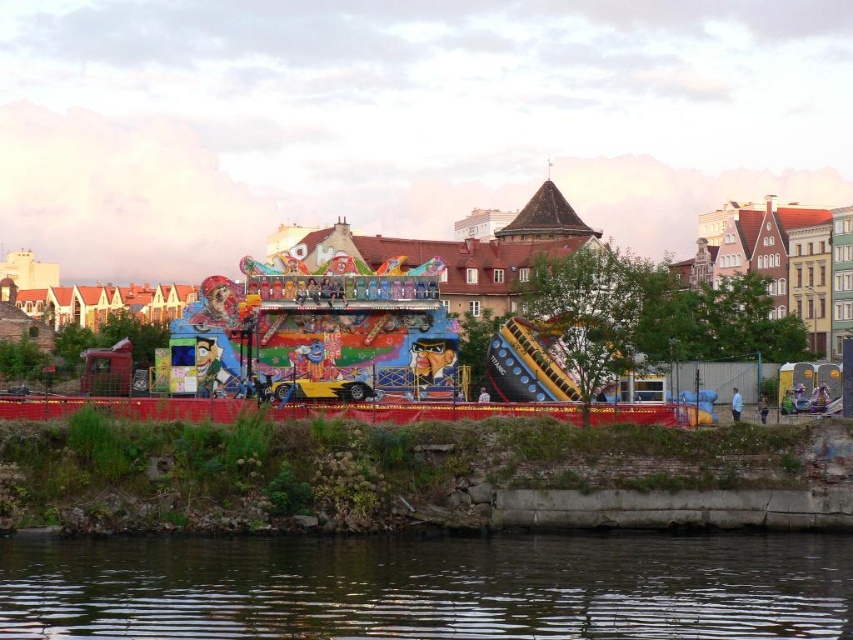
Question: Among these objects, which one is nearest to the camera?

Choices:
 (A) brick wall at lower center
 (B) colorful painted ride at center

Answer: (A)

Question: Observing the image, what is the correct spatial positioning of dark brown water at lower center in reference to brick wall at lower center?

Choices:
 (A) above
 (B) below

Answer: (B)

Question: Among these points, which one is nearest to the camera?

Choices:
 (A) (192, 516)
 (B) (561, 358)

Answer: (A)

Question: Does dark brown water at lower center have a lesser width compared to brick wall at lower center?

Choices:
 (A) yes
 (B) no

Answer: (A)

Question: Can you confirm if dark brown water at lower center is positioned to the left of colorful painted ride at center?

Choices:
 (A) yes
 (B) no

Answer: (A)

Question: Which object appears closest to the camera in this image?

Choices:
 (A) brick wall at lower center
 (B) dark brown water at lower center

Answer: (B)